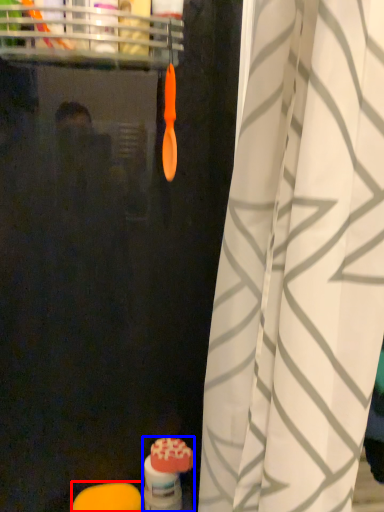
Question: Which of the following is the farthest to the observer, soap (highlighted by a red box) or toiletry (highlighted by a blue box)?

Choices:
 (A) soap
 (B) toiletry

Answer: (B)